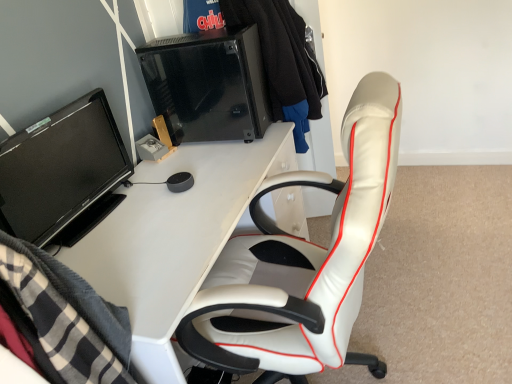
Locate an element on the screen. This screenshot has width=512, height=384. unoccupied space behind black glossy monitor at left is located at coordinates (146, 176).